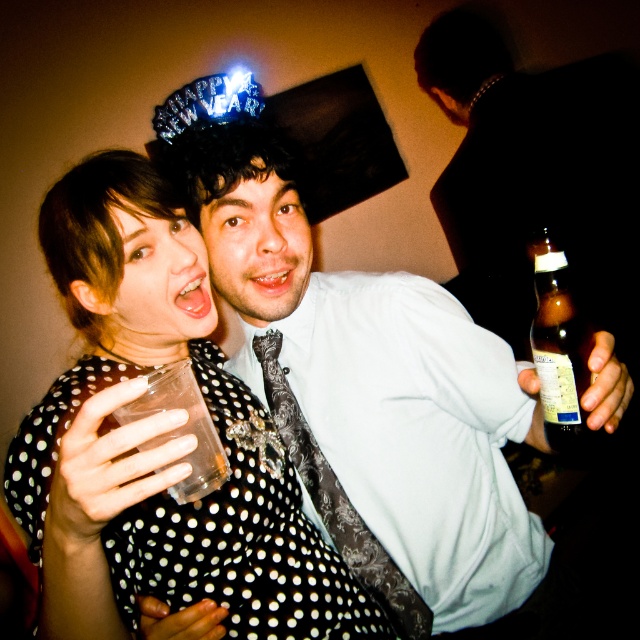
Question: Considering the real-world distances, which object is closest to the brown glass bottle at right?

Choices:
 (A) black dotted fabric dress at center
 (B) black satin tie at center
 (C) matte black shirt at center

Answer: (C)

Question: Based on their relative distances, which object is nearer to the matte black shirt at center?

Choices:
 (A) brown glass bottle at right
 (B) black dotted fabric dress at center
 (C) black satin tie at center

Answer: (C)

Question: Where is black dotted fabric dress at center located in relation to black satin tie at center in the image?

Choices:
 (A) right
 (B) left

Answer: (B)

Question: Is matte black shirt at center closer to camera compared to black satin tie at center?

Choices:
 (A) no
 (B) yes

Answer: (B)

Question: Estimate the real-world distances between objects in this image. Which object is closer to the black satin tie at center?

Choices:
 (A) matte black shirt at center
 (B) black dotted fabric dress at center

Answer: (A)

Question: Is black satin tie at center thinner than brown glass bottle at right?

Choices:
 (A) yes
 (B) no

Answer: (A)